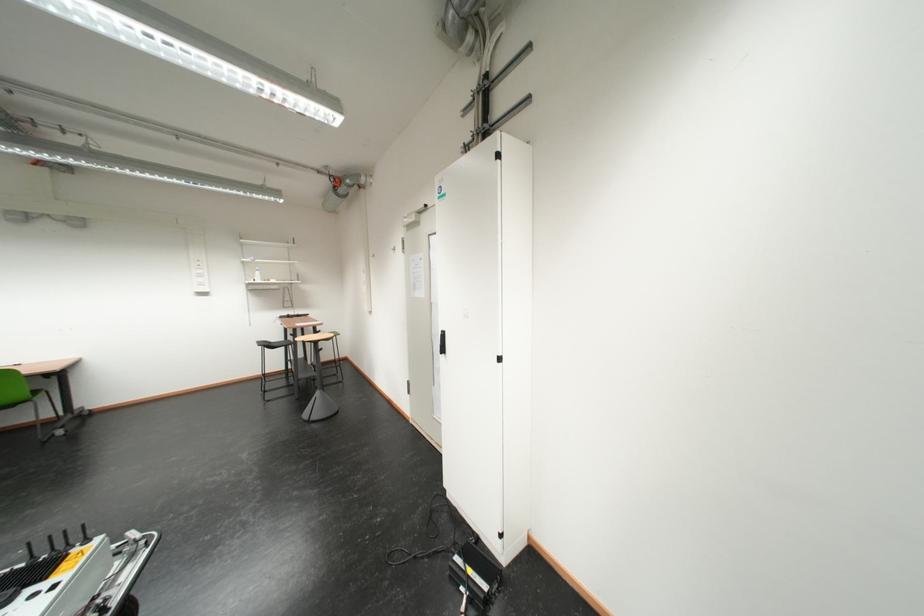
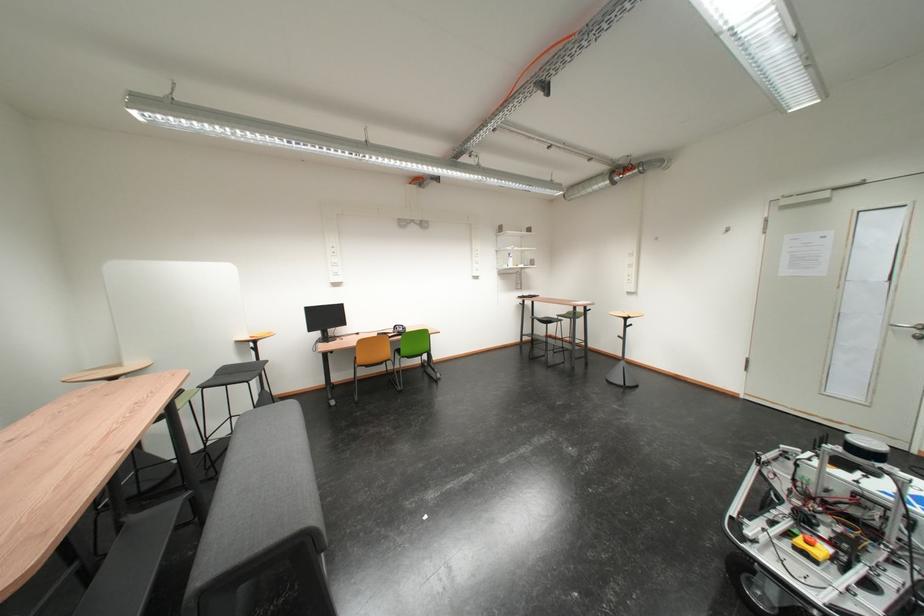
Question: The images are taken continuously from a first-person perspective. In which direction are you moving?

Choices:
 (A) Left
 (B) Right
 (C) Forward
 (D) Backward

Answer: (A)